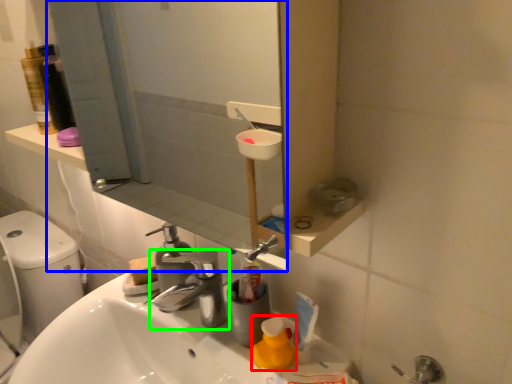
Question: Considering the real-world distances, which object is farthest from cleaning product (highlighted by a red box)? mirror (highlighted by a blue box) or tap (highlighted by a green box)?

Choices:
 (A) mirror
 (B) tap

Answer: (A)